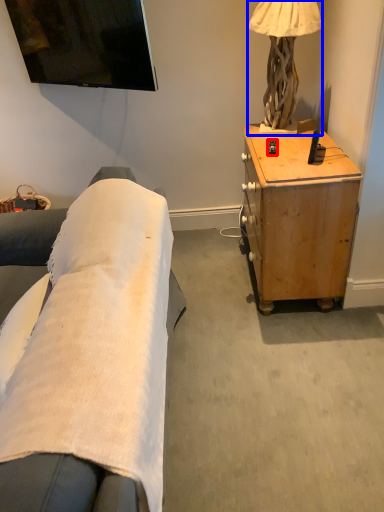
Question: Which object is further to the camera taking this photo, remote control (highlighted by a red box) or lamp (highlighted by a blue box)?

Choices:
 (A) remote control
 (B) lamp

Answer: (A)